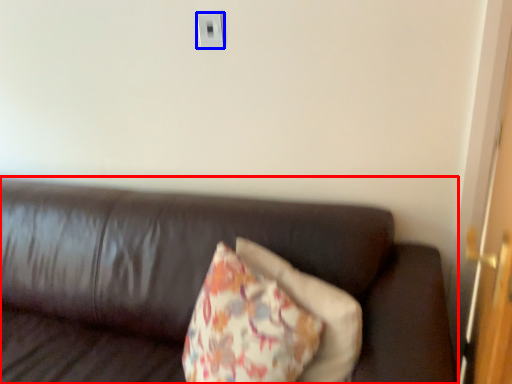
Question: Which point is further to the camera, studio couch (highlighted by a red box) or electric outlet (highlighted by a blue box)?

Choices:
 (A) studio couch
 (B) electric outlet

Answer: (B)